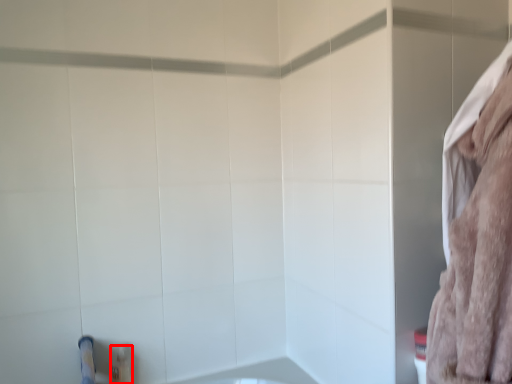
Question: From the image's perspective, considering the relative positions of toiletry (annotated by the red box) and bath towel in the image provided, where is toiletry (annotated by the red box) located with respect to the staircase?

Choices:
 (A) above
 (B) below

Answer: (B)